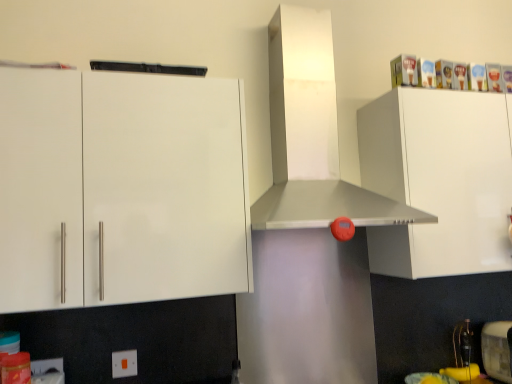
Question: Is point (404, 248) closer or farther from the camera than point (502, 357)?

Choices:
 (A) farther
 (B) closer

Answer: (B)

Question: Considering the positions of white glossy cabinet at upper right, which ranks as the 2th cabinetry in left-to-right order, and metallic silver toaster at lower right in the image, is white glossy cabinet at upper right, which ranks as the 2th cabinetry in left-to-right order, taller or shorter than metallic silver toaster at lower right?

Choices:
 (A) short
 (B) tall

Answer: (B)

Question: Which is farther from the metallic silver range hood at center?

Choices:
 (A) white plastic electric outlet at lower left, positioned as the second electric outlet in back-to-front order
 (B) white glossy cabinet at upper right, which is counted as the first cabinetry, starting from the right
 (C) white glossy cabinet at upper left, which ranks as the 2th cabinetry in right-to-left order
 (D) metallic silver toaster at lower right
 (E) white plastic electric outlet at lower center, which is the 1th electric outlet in back-to-front order

Answer: (A)

Question: Estimate the real-world distances between objects in this image. Which object is closer to the white glossy cabinet at upper right, which ranks as the 2th cabinetry in left-to-right order?

Choices:
 (A) metallic silver toaster at lower right
 (B) white plastic electric outlet at lower center, which appears as the second electric outlet when viewed from the front
 (C) white plastic electric outlet at lower left, positioned as the second electric outlet in back-to-front order
 (D) metallic silver range hood at center
 (E) white glossy cabinet at upper left, which ranks as the 2th cabinetry in right-to-left order

Answer: (D)